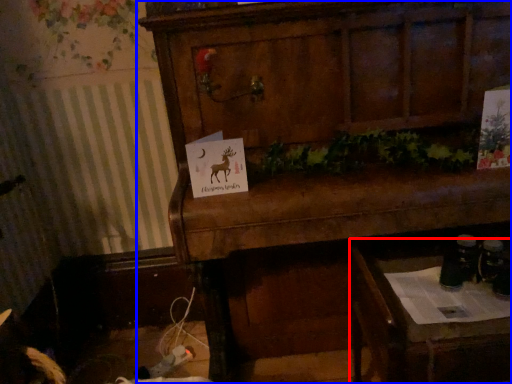
Question: Which point is further to the camera, table (highlighted by a red box) or furniture (highlighted by a blue box)?

Choices:
 (A) table
 (B) furniture

Answer: (A)